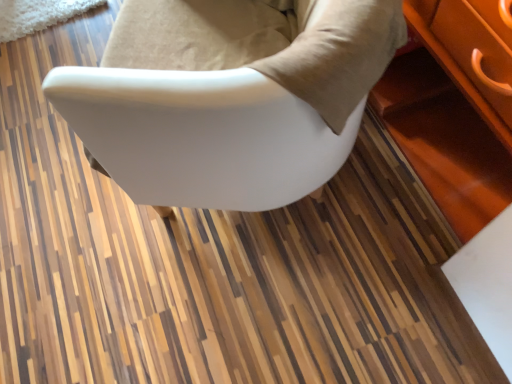
I want to click on white glossy table at lower right, so click(488, 285).

This screenshot has width=512, height=384. Describe the element at coordinates (488, 285) in the screenshot. I see `white glossy table at lower right` at that location.

The image size is (512, 384). What do you see at coordinates (229, 97) in the screenshot? I see `white matte chair at center` at bounding box center [229, 97].

Where is `white matte chair at center`? This screenshot has height=384, width=512. white matte chair at center is located at coordinates [229, 97].

Where is `white glossy table at lower right`? white glossy table at lower right is located at coordinates (488, 285).

Considering the positions of objects white glossy table at lower right and white matte chair at center in the image provided, who is more to the left, white glossy table at lower right or white matte chair at center?

From the viewer's perspective, white matte chair at center appears more on the left side.

Does white glossy table at lower right come in front of white matte chair at center?

That is False.

Is point (476, 256) closer or farther from the camera than point (104, 96)?

Point (476, 256) appears to be farther away from the viewer than point (104, 96).

From the picture: From the image's perspective, which one is positioned lower, white glossy table at lower right or white matte chair at center?

white glossy table at lower right.

From a real-world perspective, is white glossy table at lower right below white matte chair at center?

Indeed, from a real-world perspective, white glossy table at lower right is positioned beneath white matte chair at center.

Is white glossy table at lower right wider or thinner than white matte chair at center?

In the image, white glossy table at lower right appears to be more narrow than white matte chair at center.

Is white glossy table at lower right shorter than white matte chair at center?

Yes.

Who is bigger, white glossy table at lower right or white matte chair at center?

white matte chair at center is bigger.

Is white glossy table at lower right located outside white matte chair at center?

white glossy table at lower right is positioned outside white matte chair at center.

Is white glossy table at lower right far away from white matte chair at center?

No, white glossy table at lower right is not far from white matte chair at center.

Is white glossy table at lower right looking in the opposite direction of white matte chair at center?

white glossy table at lower right does not have its back to white matte chair at center.

Measure the distance from white glossy table at lower right to white matte chair at center.

The distance of white glossy table at lower right from white matte chair at center is 22.45 inches.

This screenshot has height=384, width=512. Find the location of `table that is behind the white matte chair at center`. table that is behind the white matte chair at center is located at coordinates (488, 285).

Considering the relative positions of white matte chair at center and white glossy table at lower right in the image provided, is white matte chair at center to the right of white glossy table at lower right from the viewer's perspective?

No.

Which object is further away from the camera taking this photo, white matte chair at center or white glossy table at lower right?

white glossy table at lower right is further away from the camera.

Is point (290, 16) less distant than point (479, 254)?

No, (290, 16) is further to viewer.

From the image's perspective, which is above, white matte chair at center or white glossy table at lower right?

From the image's view, white matte chair at center is above.

From a real-world perspective, is white matte chair at center above or below white glossy table at lower right?

From a real-world perspective, white matte chair at center is physically above white glossy table at lower right.

Considering the sizes of objects white matte chair at center and white glossy table at lower right in the image provided, who is thinner, white matte chair at center or white glossy table at lower right?

white glossy table at lower right.

In terms of height, does white matte chair at center look taller or shorter compared to white glossy table at lower right?

Clearly, white matte chair at center is taller compared to white glossy table at lower right.

Who is smaller, white matte chair at center or white glossy table at lower right?

Smaller between the two is white glossy table at lower right.

Is white matte chair at center inside the boundaries of white glossy table at lower right, or outside?

white matte chair at center is located beyond the bounds of white glossy table at lower right.

Would you consider white matte chair at center to be distant from white glossy table at lower right?

white matte chair at center is near white glossy table at lower right, not far away.

Could you tell me if white matte chair at center is turned towards white glossy table at lower right?

No, white matte chair at center is not aimed at white glossy table at lower right.

Measure the distance from white matte chair at center to white glossy table at lower right.

white matte chair at center and white glossy table at lower right are 22.45 inches apart from each other.

Where is `chair that appears on the left of white glossy table at lower right`? chair that appears on the left of white glossy table at lower right is located at coordinates (229, 97).

This screenshot has height=384, width=512. I want to click on chair on the left of white glossy table at lower right, so click(229, 97).

Where is `table below the white matte chair at center (from the image's perspective)`? The image size is (512, 384). table below the white matte chair at center (from the image's perspective) is located at coordinates (488, 285).